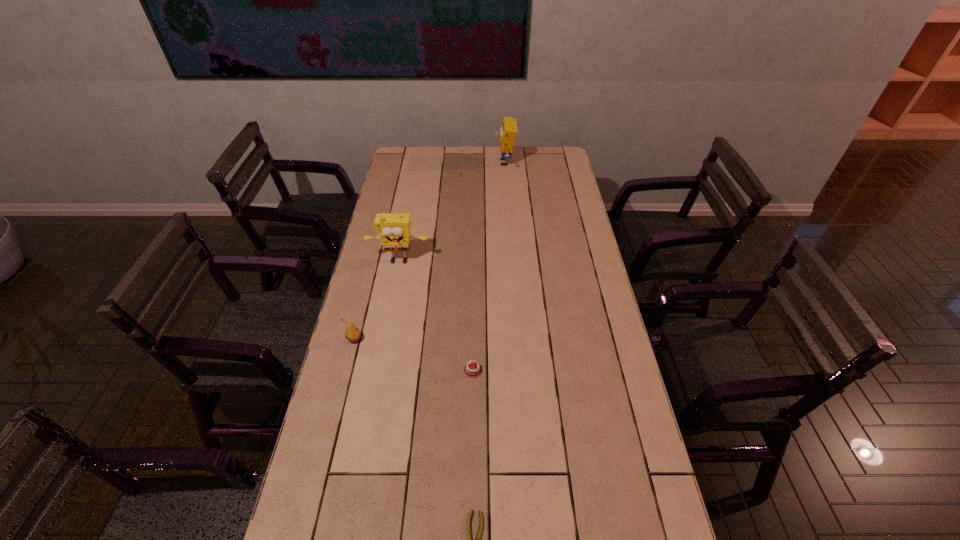
Where is `the farthest object`? the farthest object is located at coordinates (508, 131).

Where is `the rightmost object`? the rightmost object is located at coordinates (508, 131).

Where is `the left sponge`? The height and width of the screenshot is (540, 960). the left sponge is located at coordinates (394, 229).

Find the location of `the nearer sponge`. the nearer sponge is located at coordinates (394, 229).

Identify the location of pear. (352, 334).

The height and width of the screenshot is (540, 960). I want to click on the third tallest object, so click(352, 334).

You are a GUI agent. You are given a task and a screenshot of the screen. Output one action in this format:
    pyautogui.click(x=<x>, y=<y>)
    Task: Click on the second nearest object
    This screenshot has height=540, width=960.
    Given the screenshot: What is the action you would take?
    pyautogui.click(x=472, y=370)

At what (x,y) coordinates should I click in order to perform the action: click on chocolate cake. Please return your answer as a coordinate pair (x, y). Looking at the image, I should click on (472, 370).

Image resolution: width=960 pixels, height=540 pixels. Identify the location of vacant space located 0.320m on the face of the rightmost object. (432, 163).

Where is `free space located on the face of the rightmost object`? The height and width of the screenshot is (540, 960). free space located on the face of the rightmost object is located at coordinates click(420, 163).